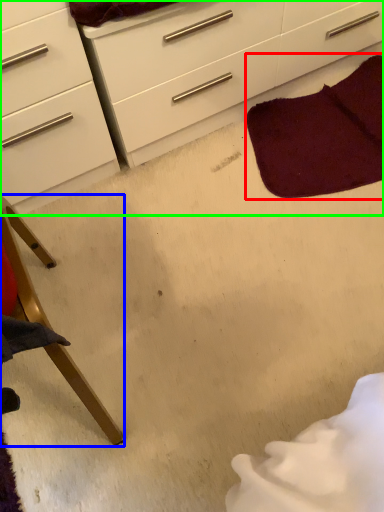
Question: Which object is positioned closest to blanket (highlighted by a red box)? Select from furniture (highlighted by a blue box) and chest of drawers (highlighted by a green box).

Choices:
 (A) furniture
 (B) chest of drawers

Answer: (B)